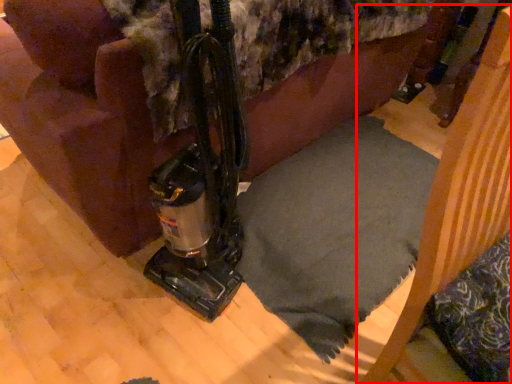
Question: In this image, where is furniture (annotated by the red box) located relative to pillow?

Choices:
 (A) left
 (B) right

Answer: (B)